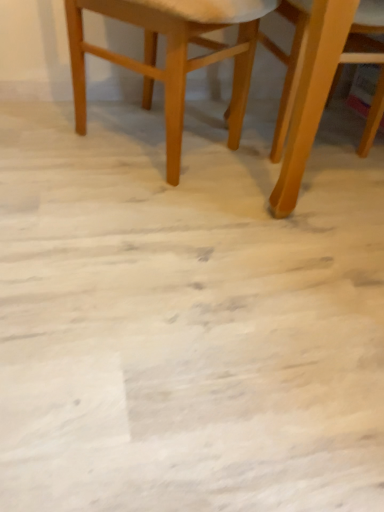
Question: From a real-world perspective, does wooden chair at center, positioned as the 2th chair in right-to-left order, stand above light brown wooden chair at upper right, arranged as the 1th chair when viewed from the right?

Choices:
 (A) yes
 (B) no

Answer: (B)

Question: Would you say wooden chair at center, positioned as the 2th chair in right-to-left order, is a long distance from light brown wooden chair at upper right, the 2th chair when ordered from left to right?

Choices:
 (A) yes
 (B) no

Answer: (B)

Question: Is wooden chair at center, which ranks as the first chair in left-to-right order, positioned beyond the bounds of light brown wooden chair at upper right, arranged as the 1th chair when viewed from the right?

Choices:
 (A) no
 (B) yes

Answer: (B)

Question: Can you confirm if wooden chair at center, positioned as the 2th chair in right-to-left order, is taller than light brown wooden chair at upper right, the 2th chair when ordered from left to right?

Choices:
 (A) yes
 (B) no

Answer: (B)

Question: From a real-world perspective, is wooden chair at center, positioned as the 2th chair in right-to-left order, under light brown wooden chair at upper right, the 2th chair when ordered from left to right?

Choices:
 (A) no
 (B) yes

Answer: (B)

Question: Is wooden chair at center, which ranks as the first chair in left-to-right order, at the right side of light brown wooden chair at upper right, arranged as the 1th chair when viewed from the right?

Choices:
 (A) yes
 (B) no

Answer: (B)

Question: Considering the relative sizes of light brown wooden chair at upper right, arranged as the 1th chair when viewed from the right, and wooden chair at center, positioned as the 2th chair in right-to-left order, in the image provided, is light brown wooden chair at upper right, arranged as the 1th chair when viewed from the right, smaller than wooden chair at center, positioned as the 2th chair in right-to-left order,?

Choices:
 (A) no
 (B) yes

Answer: (A)

Question: Considering the relative positions of light brown wooden chair at upper right, the 2th chair when ordered from left to right, and wooden chair at center, positioned as the 2th chair in right-to-left order, in the image provided, is light brown wooden chair at upper right, the 2th chair when ordered from left to right, to the left of wooden chair at center, positioned as the 2th chair in right-to-left order, from the viewer's perspective?

Choices:
 (A) yes
 (B) no

Answer: (B)

Question: Is wooden chair at center, positioned as the 2th chair in right-to-left order, inside light brown wooden chair at upper right, arranged as the 1th chair when viewed from the right?

Choices:
 (A) yes
 (B) no

Answer: (B)

Question: Can you confirm if light brown wooden chair at upper right, arranged as the 1th chair when viewed from the right, is bigger than wooden chair at center, positioned as the 2th chair in right-to-left order?

Choices:
 (A) no
 (B) yes

Answer: (B)

Question: Does light brown wooden chair at upper right, arranged as the 1th chair when viewed from the right, appear on the right side of wooden chair at center, positioned as the 2th chair in right-to-left order?

Choices:
 (A) yes
 (B) no

Answer: (A)

Question: Does light brown wooden chair at upper right, the 2th chair when ordered from left to right, have a lesser width compared to wooden chair at center, positioned as the 2th chair in right-to-left order?

Choices:
 (A) yes
 (B) no

Answer: (B)

Question: Looking at the image, does wooden chair at center, positioned as the 2th chair in right-to-left order, seem bigger or smaller compared to light brown wooden chair at upper right, arranged as the 1th chair when viewed from the right?

Choices:
 (A) big
 (B) small

Answer: (B)